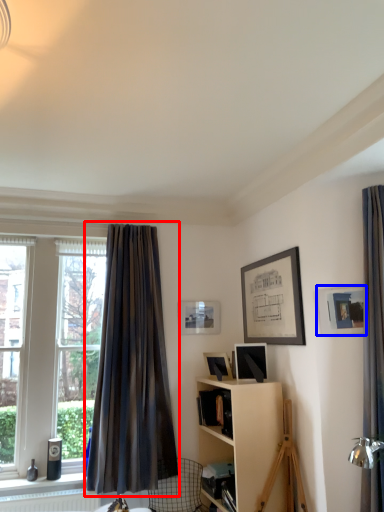
Question: Which object appears farthest to the camera in this image, curtain (highlighted by a red box) or picture frame (highlighted by a blue box)?

Choices:
 (A) curtain
 (B) picture frame

Answer: (A)